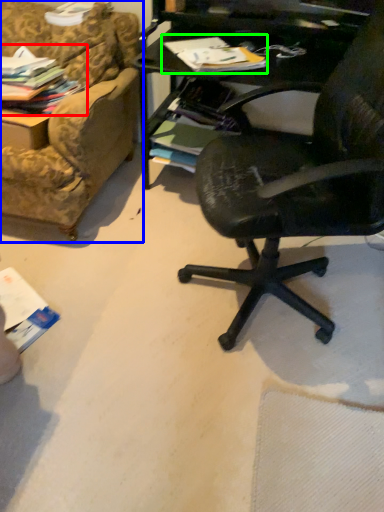
Question: Considering the real-world distances, which object is farthest from magazine (highlighted by a red box)? studio couch (highlighted by a blue box) or magazine (highlighted by a green box)?

Choices:
 (A) studio couch
 (B) magazine

Answer: (B)